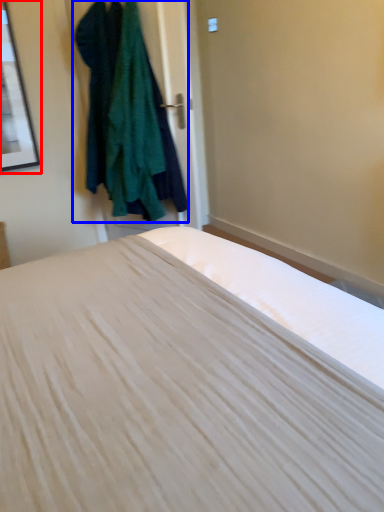
Question: Which point is closer to the camera, picture frame (highlighted by a red box) or clothing (highlighted by a blue box)?

Choices:
 (A) picture frame
 (B) clothing

Answer: (B)